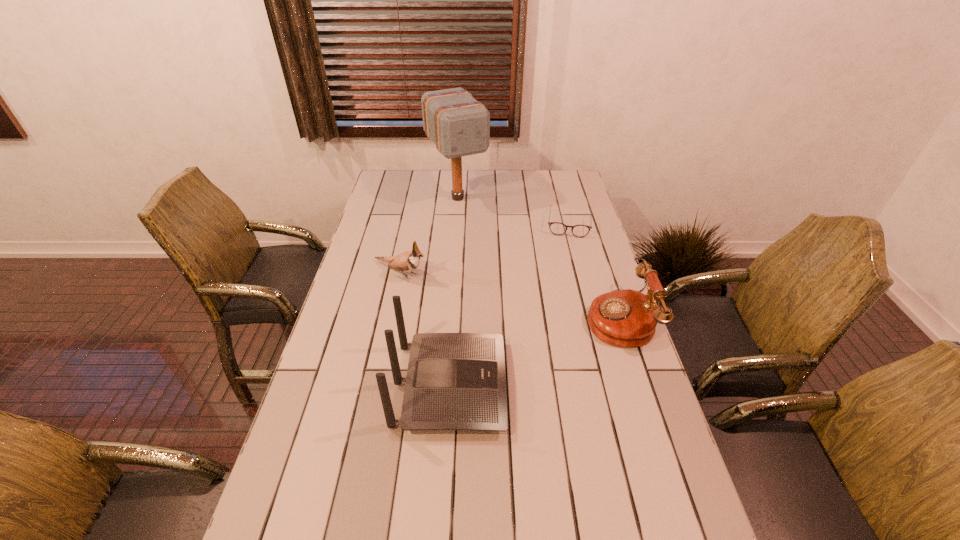
This screenshot has width=960, height=540. I want to click on free point located on the striking surface of the tallest object, so click(494, 253).

The width and height of the screenshot is (960, 540). What are the coordinates of `free region located 0.110m on the striking surface of the tallest object` in the screenshot? It's located at (479, 231).

This screenshot has width=960, height=540. I want to click on free space located at the face of the bird, so click(x=446, y=291).

Image resolution: width=960 pixels, height=540 pixels. I want to click on free location located at the face of the bird, so click(x=519, y=326).

Where is `vacant area located at the face of the bird`? Image resolution: width=960 pixels, height=540 pixels. vacant area located at the face of the bird is located at coordinates (474, 304).

Identify the location of vacant region located through the lenses of the spectacles. This screenshot has height=540, width=960. (568, 246).

Image resolution: width=960 pixels, height=540 pixels. I want to click on vacant space located 0.340m through the lenses of the spectacles, so click(564, 299).

Where is `vacant position located 0.110m through the lenses of the spectacles`? vacant position located 0.110m through the lenses of the spectacles is located at coordinates (567, 256).

Where is `object at the far edge`? object at the far edge is located at coordinates (459, 125).

Identify the location of object situated at the left edge. This screenshot has height=540, width=960. (408, 261).